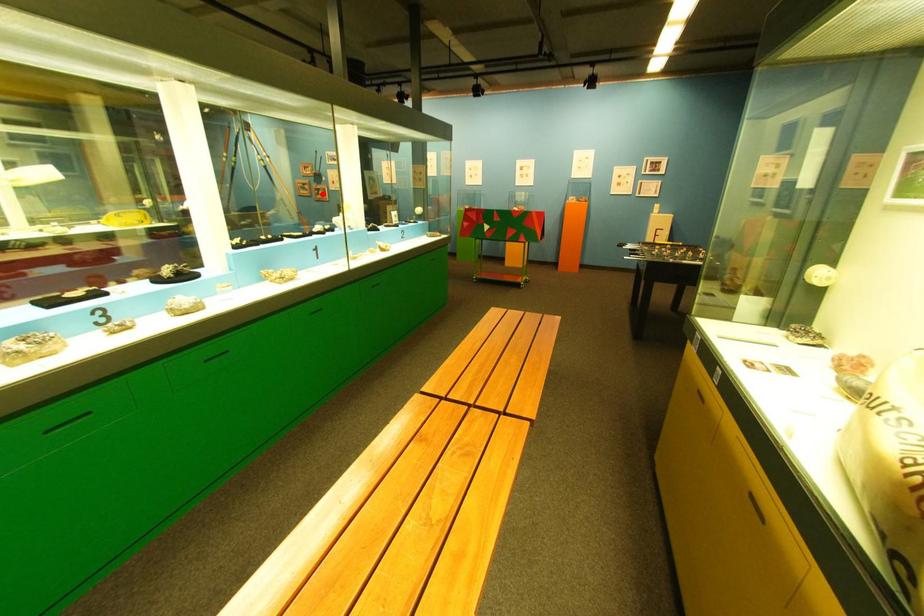
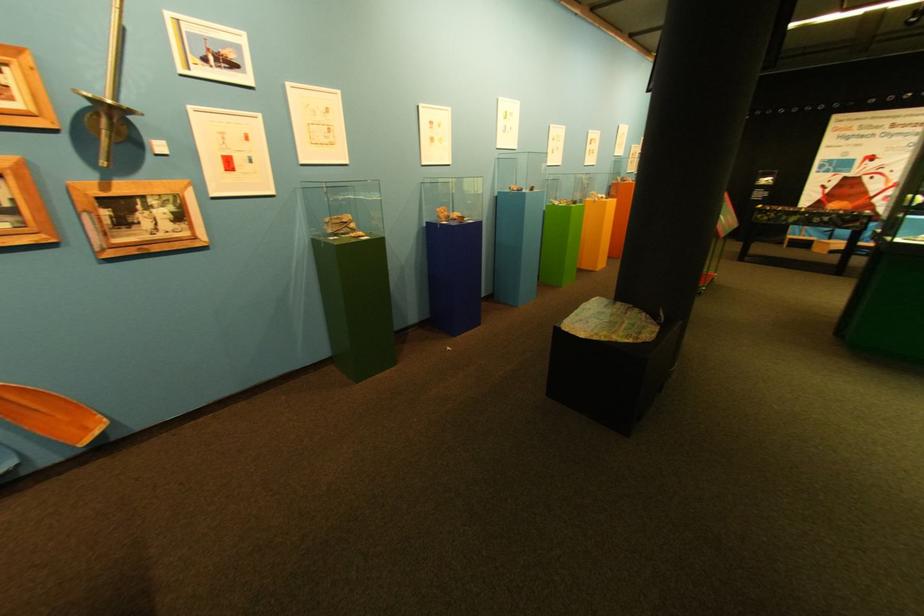
Question: I am providing you with two images of the same scene from different viewpoints. Image1 has a red point marked. In image2, the corresponding 3D location appears at what relative position? Reply with the corresponding letter.

Choices:
 (A) Closer
 (B) Farther

Answer: (B)